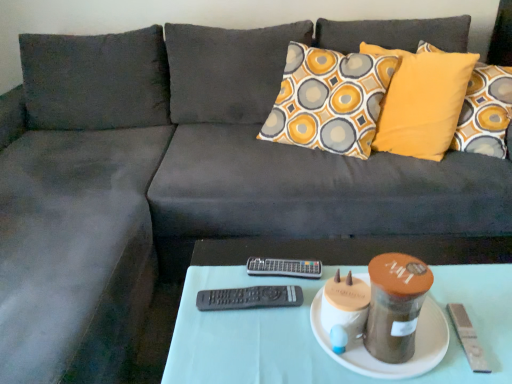
Where is `free location to the right of black plastic remote at center, placed as the first remote when sorted from back to front`? This screenshot has width=512, height=384. free location to the right of black plastic remote at center, placed as the first remote when sorted from back to front is located at coordinates (331, 260).